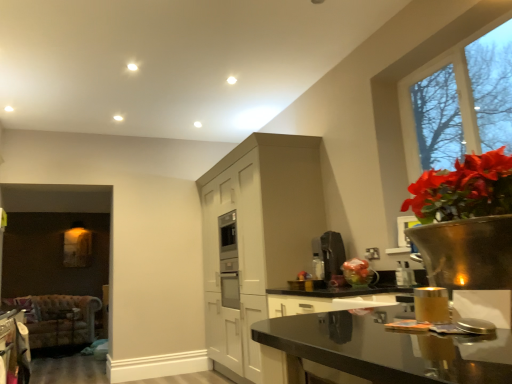
Question: Is clear glass window at upper right closer to the viewer compared to black glossy countertop at lower right?

Choices:
 (A) yes
 (B) no

Answer: (B)

Question: Would you say clear glass window at upper right contains black glossy countertop at lower right?

Choices:
 (A) yes
 (B) no

Answer: (B)

Question: Considering the relative sizes of clear glass window at upper right and black glossy countertop at lower right in the image provided, is clear glass window at upper right taller than black glossy countertop at lower right?

Choices:
 (A) no
 (B) yes

Answer: (B)

Question: Is clear glass window at upper right turned away from black glossy countertop at lower right?

Choices:
 (A) yes
 (B) no

Answer: (B)

Question: From the image's perspective, is clear glass window at upper right located beneath black glossy countertop at lower right?

Choices:
 (A) no
 (B) yes

Answer: (A)

Question: Considering the relative positions of velvet-patterned armchair at lower left and white matte cabinetry at center in the image provided, is velvet-patterned armchair at lower left to the left or to the right of white matte cabinetry at center?

Choices:
 (A) right
 (B) left

Answer: (B)

Question: From the image's perspective, relative to white matte cabinetry at center, is velvet-patterned armchair at lower left above or below?

Choices:
 (A) below
 (B) above

Answer: (A)

Question: Is velvet-patterned armchair at lower left in front of or behind white matte cabinetry at center in the image?

Choices:
 (A) front
 (B) behind

Answer: (B)

Question: Based on their sizes in the image, would you say velvet-patterned armchair at lower left is bigger or smaller than white matte cabinetry at center?

Choices:
 (A) big
 (B) small

Answer: (B)

Question: From their relative heights in the image, would you say clear glass window at upper right is taller or shorter than white matte cabinetry at center?

Choices:
 (A) tall
 (B) short

Answer: (B)

Question: Is clear glass window at upper right wider or thinner than white matte cabinetry at center?

Choices:
 (A) thin
 (B) wide

Answer: (A)

Question: Would you say clear glass window at upper right is to the left or to the right of white matte cabinetry at center in the picture?

Choices:
 (A) left
 (B) right

Answer: (B)

Question: Is clear glass window at upper right in front of or behind white matte cabinetry at center in the image?

Choices:
 (A) behind
 (B) front

Answer: (B)

Question: From a real-world perspective, is satin silver coffee maker at upper right, acting as the first appliance starting from the front, physically located above or below satin black coffee machine at center, the 1th appliance viewed from the left?

Choices:
 (A) below
 (B) above

Answer: (A)

Question: Is point (412, 276) closer or farther from the camera than point (335, 238)?

Choices:
 (A) farther
 (B) closer

Answer: (B)